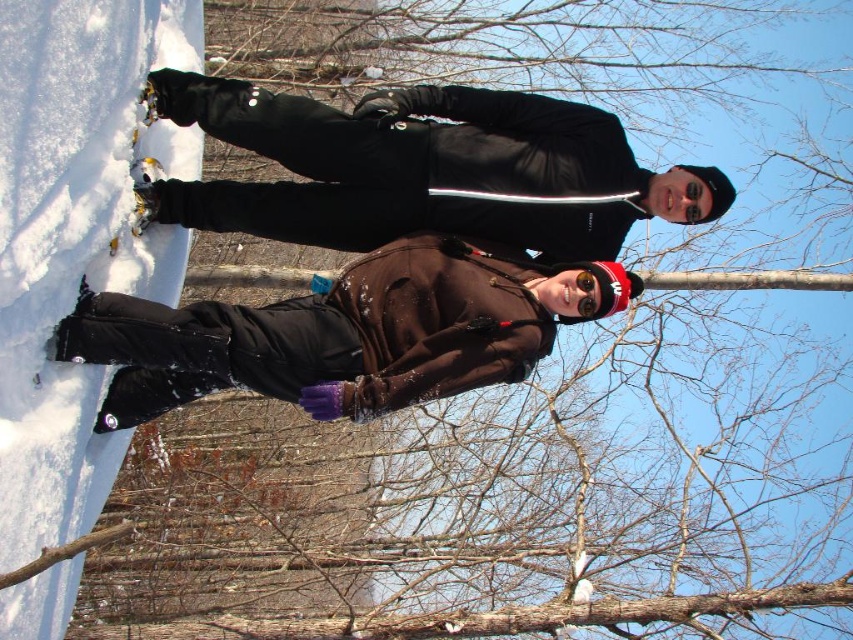
Does point (306, 100) come closer to viewer compared to point (467, 296)?

That is False.

Between black matte jacket at upper center and brown matte jacket at center, which one is positioned higher?

black matte jacket at upper center is higher up.

Who is more forward, (460, 97) or (454, 387)?

Point (454, 387) is in front.

Identify the location of black matte jacket at upper center. [x=426, y=170].